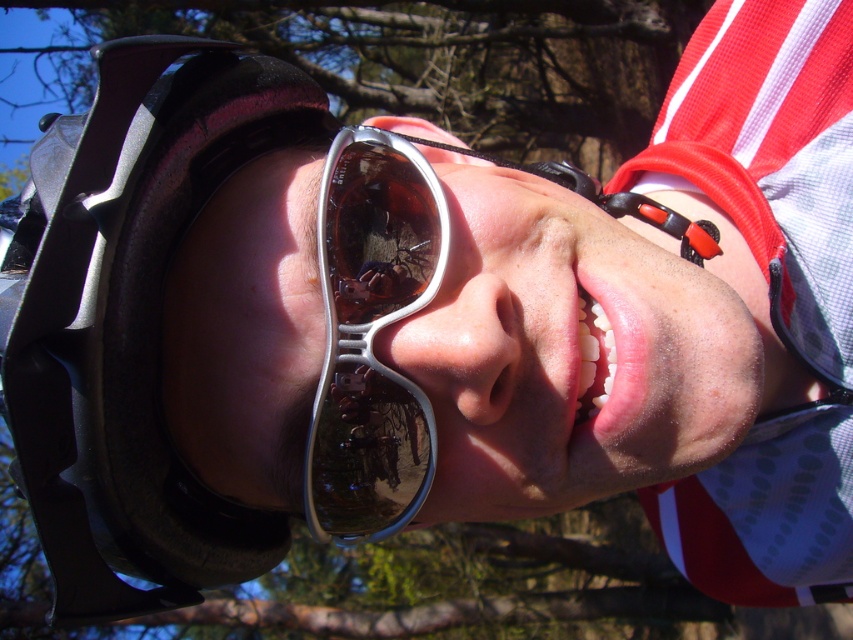
The image size is (853, 640). What do you see at coordinates (122, 326) in the screenshot?
I see `black matte helmet at left` at bounding box center [122, 326].

Between black matte helmet at left and silver metallic sunglasses at center, which one has less height?

Standing shorter between the two is silver metallic sunglasses at center.

Describe the element at coordinates (122, 326) in the screenshot. The width and height of the screenshot is (853, 640). I see `black matte helmet at left` at that location.

Image resolution: width=853 pixels, height=640 pixels. I want to click on black matte helmet at left, so click(x=122, y=326).